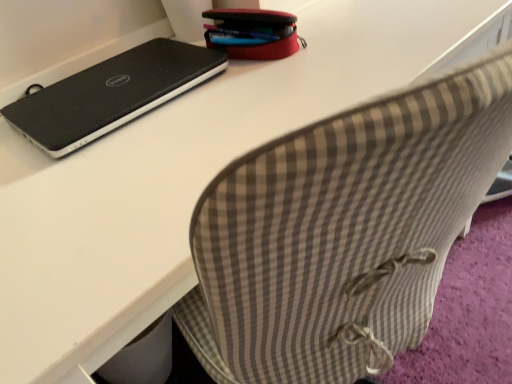
Locate an element on the screen. Image resolution: width=512 pixels, height=384 pixels. blank space above black matte laptop at upper left (from a real-world perspective) is located at coordinates 114,76.